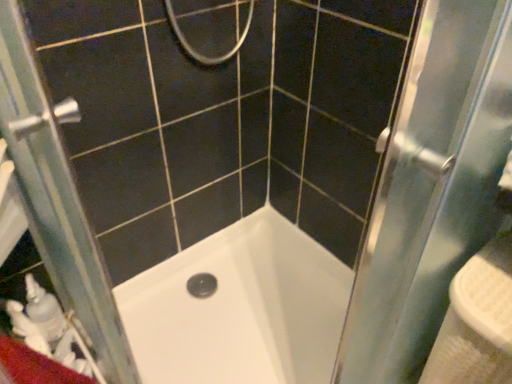
Question: Is the position of white plastic sink at right less distant than that of clear glass screen door at left?

Choices:
 (A) yes
 (B) no

Answer: (B)

Question: Considering the relative sizes of white plastic sink at right and clear glass screen door at left in the image provided, is white plastic sink at right smaller than clear glass screen door at left?

Choices:
 (A) no
 (B) yes

Answer: (B)

Question: From a real-world perspective, is white plastic sink at right below clear glass screen door at left?

Choices:
 (A) no
 (B) yes

Answer: (B)

Question: Is white plastic sink at right to the left of clear glass screen door at left from the viewer's perspective?

Choices:
 (A) yes
 (B) no

Answer: (B)

Question: Is white plastic sink at right positioned behind clear glass screen door at left?

Choices:
 (A) yes
 (B) no

Answer: (A)

Question: Is white plastic sink at right taller or shorter than white glossy bathtub at center?

Choices:
 (A) tall
 (B) short

Answer: (A)

Question: From the image's perspective, relative to white glossy bathtub at center, is white plastic sink at right above or below?

Choices:
 (A) above
 (B) below

Answer: (A)

Question: In terms of size, does white plastic sink at right appear bigger or smaller than white glossy bathtub at center?

Choices:
 (A) small
 (B) big

Answer: (A)

Question: Is white plastic sink at right spatially inside white glossy bathtub at center, or outside of it?

Choices:
 (A) inside
 (B) outside

Answer: (B)

Question: Based on their positions, is white glossy bathtub at center located to the left or right of clear glass screen door at left?

Choices:
 (A) right
 (B) left

Answer: (A)

Question: Is white glossy bathtub at center bigger or smaller than clear glass screen door at left?

Choices:
 (A) small
 (B) big

Answer: (B)

Question: Relative to clear glass screen door at left, is white glossy bathtub at center in front or behind?

Choices:
 (A) behind
 (B) front

Answer: (A)

Question: Looking at their shapes, would you say white glossy bathtub at center is wider or thinner than clear glass screen door at left?

Choices:
 (A) wide
 (B) thin

Answer: (A)

Question: Considering the positions of clear glass screen door at left and white glossy bathtub at center in the image, is clear glass screen door at left taller or shorter than white glossy bathtub at center?

Choices:
 (A) short
 (B) tall

Answer: (B)

Question: Based on their positions, is clear glass screen door at left located to the left or right of white glossy bathtub at center?

Choices:
 (A) right
 (B) left

Answer: (B)